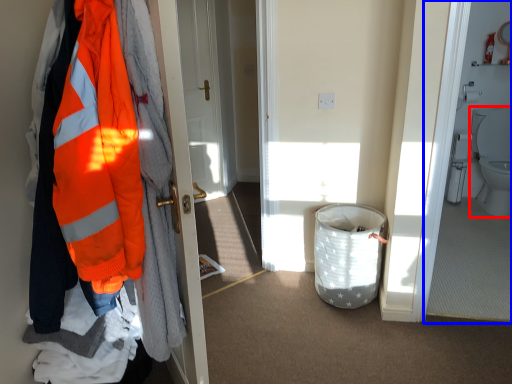
Question: Which of the following is the closest to the observer, toilet (highlighted by a red box) or corridor (highlighted by a blue box)?

Choices:
 (A) toilet
 (B) corridor

Answer: (B)